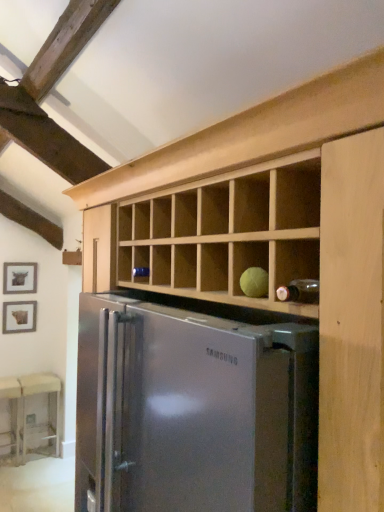
Question: From a real-world perspective, is beige fabric table at lower left, positioned as the 2th table in left-to-right order, physically located above or below matte brown picture frame at left, which is the 1th picture frame from bottom to top?

Choices:
 (A) above
 (B) below

Answer: (B)

Question: Considering the positions of beige fabric table at lower left, positioned as the 2th table in left-to-right order, and matte brown picture frame at left, positioned as the 2th picture frame in top-to-bottom order, in the image, is beige fabric table at lower left, positioned as the 2th table in left-to-right order, wider or thinner than matte brown picture frame at left, positioned as the 2th picture frame in top-to-bottom order,?

Choices:
 (A) thin
 (B) wide

Answer: (B)

Question: Which object is the farthest from the beige fabric table at lower left, which appears as the 1th table when viewed from the right?

Choices:
 (A) stainless steel refrigerator at center
 (B) wooden table at lower left, the 1th table in the left-to-right sequence
 (C) matte brown picture frame at left, positioned as the 2th picture frame in top-to-bottom order
 (D) matte black picture frame at left, the 2th picture frame in the bottom-to-top sequence

Answer: (A)

Question: Estimate the real-world distances between objects in this image. Which object is farther from the matte black picture frame at left, the 2th picture frame in the bottom-to-top sequence?

Choices:
 (A) wooden table at lower left, the 1th table in the left-to-right sequence
 (B) matte brown picture frame at left, positioned as the 2th picture frame in top-to-bottom order
 (C) beige fabric table at lower left, positioned as the 2th table in left-to-right order
 (D) stainless steel refrigerator at center

Answer: (D)